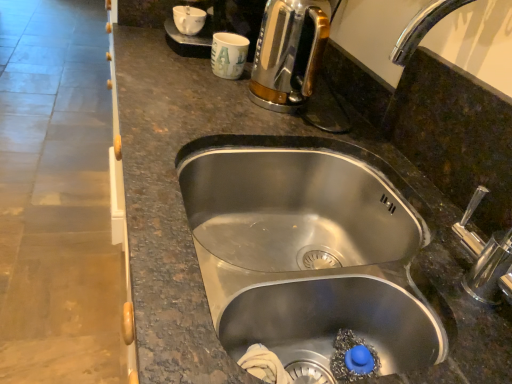
This screenshot has width=512, height=384. In order to click on white paper cup at upper center, acting as the 1th coffee cup starting from the right in this screenshot , I will do `click(228, 55)`.

What do you see at coordinates (189, 19) in the screenshot? I see `white glossy coffee cup at upper center, which is the 1th coffee cup in left-to-right order` at bounding box center [189, 19].

Find the location of a particular element. This screenshot has height=384, width=512. white glossy coffee cup at upper center, which appears as the second coffee cup when ordered from the bottom is located at coordinates (189, 19).

Identify the location of white paper cup at upper center, the first coffee cup ordered from the bottom. (x=228, y=55).

Considering the sizes of objects white paper cup at upper center, acting as the 1th coffee cup starting from the right, and shiny metallic kettle at upper right in the image provided, who is shorter, white paper cup at upper center, acting as the 1th coffee cup starting from the right, or shiny metallic kettle at upper right?

white paper cup at upper center, acting as the 1th coffee cup starting from the right.

In the scene shown: Is white paper cup at upper center, the second coffee cup positioned from the top, aimed at shiny metallic kettle at upper right?

No, white paper cup at upper center, the second coffee cup positioned from the top, is not turned towards shiny metallic kettle at upper right.

Considering the sizes of white paper cup at upper center, the first coffee cup ordered from the bottom, and shiny metallic kettle at upper right in the image, is white paper cup at upper center, the first coffee cup ordered from the bottom, bigger or smaller than shiny metallic kettle at upper right?

In the image, white paper cup at upper center, the first coffee cup ordered from the bottom, appears to be smaller than shiny metallic kettle at upper right.

Would you say white paper cup at upper center, which ranks as the 2th coffee cup in left-to-right order, is inside or outside shiny metallic kettle at upper right?

white paper cup at upper center, which ranks as the 2th coffee cup in left-to-right order, is not enclosed by shiny metallic kettle at upper right.

Based on their sizes in the image, would you say white glossy coffee cup at upper center, marked as the 2th coffee cup in a right-to-left arrangement, is bigger or smaller than shiny metallic kettle at upper right?

In the image, white glossy coffee cup at upper center, marked as the 2th coffee cup in a right-to-left arrangement, appears to be smaller than shiny metallic kettle at upper right.

Is white glossy coffee cup at upper center, marked as the 2th coffee cup in a right-to-left arrangement, positioned far away from shiny metallic kettle at upper right?

Actually, white glossy coffee cup at upper center, marked as the 2th coffee cup in a right-to-left arrangement, and shiny metallic kettle at upper right are a little close together.

In the image, is white glossy coffee cup at upper center, which appears as the second coffee cup when ordered from the bottom, positioned in front of or behind shiny metallic kettle at upper right?

Visually, white glossy coffee cup at upper center, which appears as the second coffee cup when ordered from the bottom, is located behind shiny metallic kettle at upper right.

Considering the relative sizes of white glossy coffee cup at upper center, which is the 1th coffee cup in top-to-bottom order, and shiny metallic kettle at upper right in the image provided, is white glossy coffee cup at upper center, which is the 1th coffee cup in top-to-bottom order, shorter than shiny metallic kettle at upper right?

Correct, white glossy coffee cup at upper center, which is the 1th coffee cup in top-to-bottom order, is not as tall as shiny metallic kettle at upper right.

From the image's perspective, is stainless steel sink at center below shiny metallic kettle at upper right?

Yes.

Considering the relative positions of stainless steel sink at center and shiny metallic kettle at upper right in the image provided, is stainless steel sink at center to the right of shiny metallic kettle at upper right from the viewer's perspective?

Yes.

Which of these two, stainless steel sink at center or shiny metallic kettle at upper right, is thinner?

shiny metallic kettle at upper right is thinner.

Between stainless steel sink at center and shiny metallic kettle at upper right, which one is positioned behind?

Positioned behind is shiny metallic kettle at upper right.

From a real-world perspective, does white glossy coffee cup at upper center, which is the 1th coffee cup in left-to-right order, sit lower than white paper cup at upper center, the second coffee cup positioned from the top?

No, from a real-world perspective, white glossy coffee cup at upper center, which is the 1th coffee cup in left-to-right order, is not under white paper cup at upper center, the second coffee cup positioned from the top.

Which is more to the left, white glossy coffee cup at upper center, which is the 1th coffee cup in left-to-right order, or white paper cup at upper center, the second coffee cup positioned from the top?

From the viewer's perspective, white glossy coffee cup at upper center, which is the 1th coffee cup in left-to-right order, appears more on the left side.

Which point is more forward, [190,28] or [231,76]?

A: The point [231,76] is in front.

Where is `coffee cup below the white glossy coffee cup at upper center, which is the 1th coffee cup in left-to-right order (from a real-world perspective)`? This screenshot has height=384, width=512. coffee cup below the white glossy coffee cup at upper center, which is the 1th coffee cup in left-to-right order (from a real-world perspective) is located at coordinates (228, 55).

Considering the relative positions of white glossy coffee cup at upper center, which is the 1th coffee cup in left-to-right order, and stainless steel sink at center in the image provided, is white glossy coffee cup at upper center, which is the 1th coffee cup in left-to-right order, to the left of stainless steel sink at center from the viewer's perspective?

Yes, white glossy coffee cup at upper center, which is the 1th coffee cup in left-to-right order, is to the left of stainless steel sink at center.

How different are the orientations of white glossy coffee cup at upper center, which is the 1th coffee cup in left-to-right order, and stainless steel sink at center in degrees?

The angle between the facing direction of white glossy coffee cup at upper center, which is the 1th coffee cup in left-to-right order, and the facing direction of stainless steel sink at center is 3.41 degrees.

Is white glossy coffee cup at upper center, which is the 1th coffee cup in left-to-right order, bigger or smaller than stainless steel sink at center?

white glossy coffee cup at upper center, which is the 1th coffee cup in left-to-right order, is smaller than stainless steel sink at center.

Consider the image. Is stainless steel sink at center far away from white paper cup at upper center, which ranks as the 2th coffee cup in left-to-right order?

No, there isn't a large distance between stainless steel sink at center and white paper cup at upper center, which ranks as the 2th coffee cup in left-to-right order.

From a real-world perspective, relative to white paper cup at upper center, which ranks as the 2th coffee cup in left-to-right order, is stainless steel sink at center vertically above or below?

In terms of real-world spatial position, stainless steel sink at center is below white paper cup at upper center, which ranks as the 2th coffee cup in left-to-right order.

Does stainless steel sink at center appear on the left side of white paper cup at upper center, which ranks as the 2th coffee cup in left-to-right order?

In fact, stainless steel sink at center is to the right of white paper cup at upper center, which ranks as the 2th coffee cup in left-to-right order.

Which is closer to the camera, (243, 69) or (492, 180)?

Clearly, point (243, 69) is more distant from the camera than point (492, 180).

Is white paper cup at upper center, acting as the 1th coffee cup starting from the right, surrounding stainless steel sink at center?

No, stainless steel sink at center is not surrounded by white paper cup at upper center, acting as the 1th coffee cup starting from the right.

From the image's perspective, is white paper cup at upper center, the second coffee cup positioned from the top, below stainless steel sink at center?

Actually, white paper cup at upper center, the second coffee cup positioned from the top, appears above stainless steel sink at center in the image.

There is a shiny metallic kettle at upper right. Identify the location of the 1st coffee cup above it (from the image's perspective). pyautogui.click(x=228, y=55).

Locate an element on the screen. Image resolution: width=512 pixels, height=384 pixels. coffee maker below the white glossy coffee cup at upper center, which appears as the second coffee cup when ordered from the bottom (from the image's perspective) is located at coordinates tap(289, 53).

Looking at the image, which one is located further to stainless steel sink at center, white glossy coffee cup at upper center, which is the 1th coffee cup in top-to-bottom order, or white paper cup at upper center, acting as the 1th coffee cup starting from the right?

Among the two, white glossy coffee cup at upper center, which is the 1th coffee cup in top-to-bottom order, is located further to stainless steel sink at center.

When comparing their distances from white glossy coffee cup at upper center, marked as the 2th coffee cup in a right-to-left arrangement, does shiny metallic kettle at upper right or stainless steel sink at center seem further?

stainless steel sink at center is positioned further to the anchor white glossy coffee cup at upper center, marked as the 2th coffee cup in a right-to-left arrangement.

Estimate the real-world distances between objects in this image. Which object is further from white paper cup at upper center, acting as the 1th coffee cup starting from the right, shiny metallic kettle at upper right or white glossy coffee cup at upper center, which is the 1th coffee cup in top-to-bottom order?

white glossy coffee cup at upper center, which is the 1th coffee cup in top-to-bottom order, lies further to white paper cup at upper center, acting as the 1th coffee cup starting from the right, than the other object.

When comparing their distances from stainless steel sink at center, does shiny metallic kettle at upper right or white paper cup at upper center, the second coffee cup positioned from the top, seem closer?

Among the two, shiny metallic kettle at upper right is located nearer to stainless steel sink at center.

Considering their positions, is stainless steel sink at center positioned further to white glossy coffee cup at upper center, which is the 1th coffee cup in left-to-right order, than white paper cup at upper center, which ranks as the 2th coffee cup in left-to-right order?

stainless steel sink at center is positioned further to the anchor white glossy coffee cup at upper center, which is the 1th coffee cup in left-to-right order.

Based on the photo, from the image, which object appears to be nearer to white paper cup at upper center, the first coffee cup ordered from the bottom, white glossy coffee cup at upper center, marked as the 2th coffee cup in a right-to-left arrangement, or shiny metallic kettle at upper right?

shiny metallic kettle at upper right lies closer to white paper cup at upper center, the first coffee cup ordered from the bottom, than the other object.

When comparing their distances from stainless steel sink at center, does white paper cup at upper center, acting as the 1th coffee cup starting from the right, or white glossy coffee cup at upper center, which is the 1th coffee cup in top-to-bottom order, seem closer?

white paper cup at upper center, acting as the 1th coffee cup starting from the right, lies closer to stainless steel sink at center than the other object.

Estimate the real-world distances between objects in this image. Which object is further from white glossy coffee cup at upper center, marked as the 2th coffee cup in a right-to-left arrangement, white paper cup at upper center, the second coffee cup positioned from the top, or stainless steel sink at center?

stainless steel sink at center is further to white glossy coffee cup at upper center, marked as the 2th coffee cup in a right-to-left arrangement.

Identify the location of coffee cup between shiny metallic kettle at upper right and white glossy coffee cup at upper center, which appears as the second coffee cup when ordered from the bottom, along the z-axis. (228, 55).

Identify the location of coffee maker positioned between stainless steel sink at center and white glossy coffee cup at upper center, marked as the 2th coffee cup in a right-to-left arrangement, from near to far. The width and height of the screenshot is (512, 384). (289, 53).

Identify the location of coffee maker positioned between stainless steel sink at center and white paper cup at upper center, acting as the 1th coffee cup starting from the right, from near to far. (289, 53).

Find the location of a particular element. coffee cup between stainless steel sink at center and white glossy coffee cup at upper center, which is the 1th coffee cup in top-to-bottom order, along the z-axis is located at coordinates (228, 55).